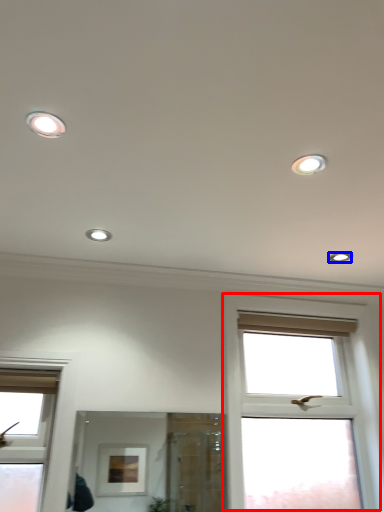
Question: Among these objects, which one is nearest to the camera, window (highlighted by a red box) or dot (highlighted by a blue box)?

Choices:
 (A) window
 (B) dot

Answer: (A)